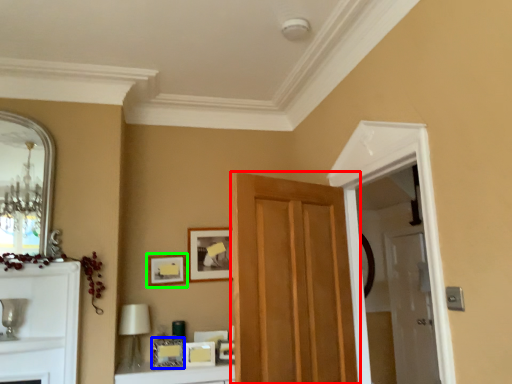
Question: Which object is the farthest from door (highlighted by a red box)? Choose among these: picture frame (highlighted by a blue box) or picture frame (highlighted by a green box).

Choices:
 (A) picture frame
 (B) picture frame

Answer: (B)